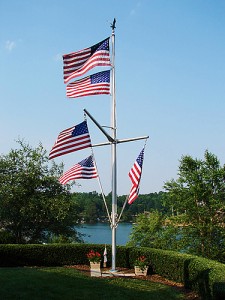
Image resolution: width=225 pixels, height=300 pixels. What are the coordinates of `flower container` in the screenshot? It's located at (94, 266), (140, 271).